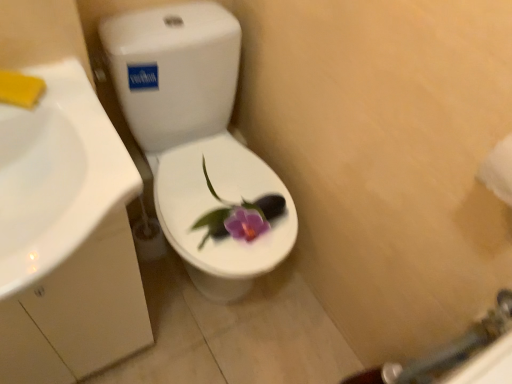
Question: Considering the relative sizes of white glossy sink at left and white paper towel at right in the image provided, is white glossy sink at left thinner than white paper towel at right?

Choices:
 (A) yes
 (B) no

Answer: (B)

Question: From a real-world perspective, is white glossy sink at left located beneath white paper towel at right?

Choices:
 (A) yes
 (B) no

Answer: (A)

Question: Does white glossy sink at left have a larger size compared to white paper towel at right?

Choices:
 (A) yes
 (B) no

Answer: (A)

Question: Can you confirm if white glossy sink at left is smaller than white paper towel at right?

Choices:
 (A) no
 (B) yes

Answer: (A)

Question: Is white glossy sink at left at the right side of white paper towel at right?

Choices:
 (A) yes
 (B) no

Answer: (B)

Question: Is white glossy sink at left further to the viewer compared to white paper towel at right?

Choices:
 (A) yes
 (B) no

Answer: (B)

Question: Is white paper towel at right surrounding white glossy sink at left?

Choices:
 (A) no
 (B) yes

Answer: (A)

Question: Can you confirm if white paper towel at right is wider than white glossy sink at left?

Choices:
 (A) yes
 (B) no

Answer: (B)

Question: Is white paper towel at right turned away from white glossy sink at left?

Choices:
 (A) no
 (B) yes

Answer: (A)

Question: From the image's perspective, is white paper towel at right under white glossy sink at left?

Choices:
 (A) yes
 (B) no

Answer: (B)

Question: Does white paper towel at right turn towards white glossy sink at left?

Choices:
 (A) yes
 (B) no

Answer: (B)

Question: From the image's perspective, does white paper towel at right appear higher than white glossy sink at left?

Choices:
 (A) yes
 (B) no

Answer: (A)

Question: From a real-world perspective, does white glossy sink at left sit lower than white glossy toilet at center?

Choices:
 (A) yes
 (B) no

Answer: (B)